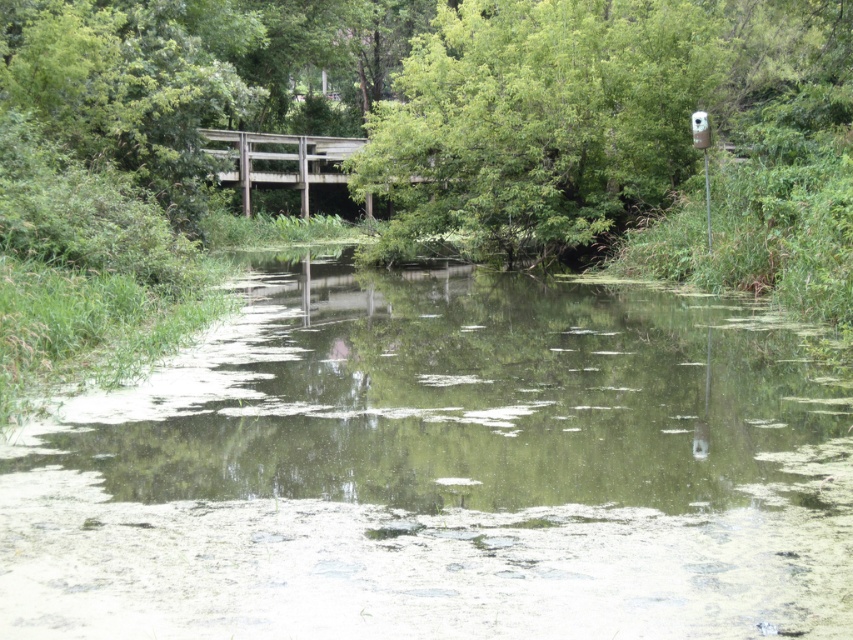
Question: Which object is farther from the camera taking this photo?

Choices:
 (A) weathered wood bridge at center
 (B) green algae-covered water at center

Answer: (A)

Question: Does green algae-covered water at center appear on the right side of weathered wood bridge at center?

Choices:
 (A) no
 (B) yes

Answer: (B)

Question: Can you confirm if green algae-covered water at center is smaller than weathered wood bridge at center?

Choices:
 (A) no
 (B) yes

Answer: (B)

Question: Does green algae-covered water at center have a greater width compared to weathered wood bridge at center?

Choices:
 (A) no
 (B) yes

Answer: (B)

Question: Which object appears closest to the camera in this image?

Choices:
 (A) weathered wood bridge at center
 (B) green algae-covered water at center

Answer: (B)